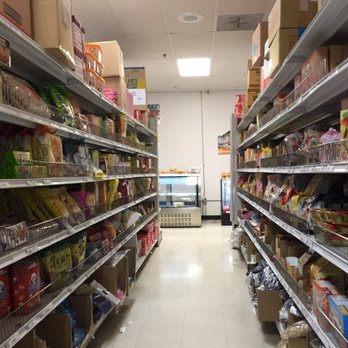
You are a GUI agent. You are given a task and a screenshot of the screen. Output one action in this format:
    pyautogui.click(x=<x>, y=<y>)
    Task: Click on the boxes on shelves
    
    Given the screenshot: What is the action you would take?
    pyautogui.click(x=267, y=303), pyautogui.click(x=114, y=272), pyautogui.click(x=87, y=302), pyautogui.click(x=65, y=329)